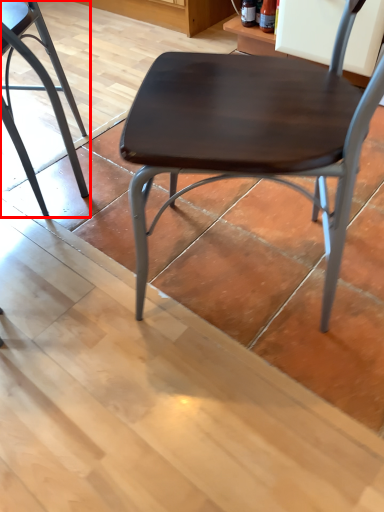
Question: From the image's perspective, where is chair (annotated by the red box) located in relation to chair in the image?

Choices:
 (A) below
 (B) above

Answer: (B)